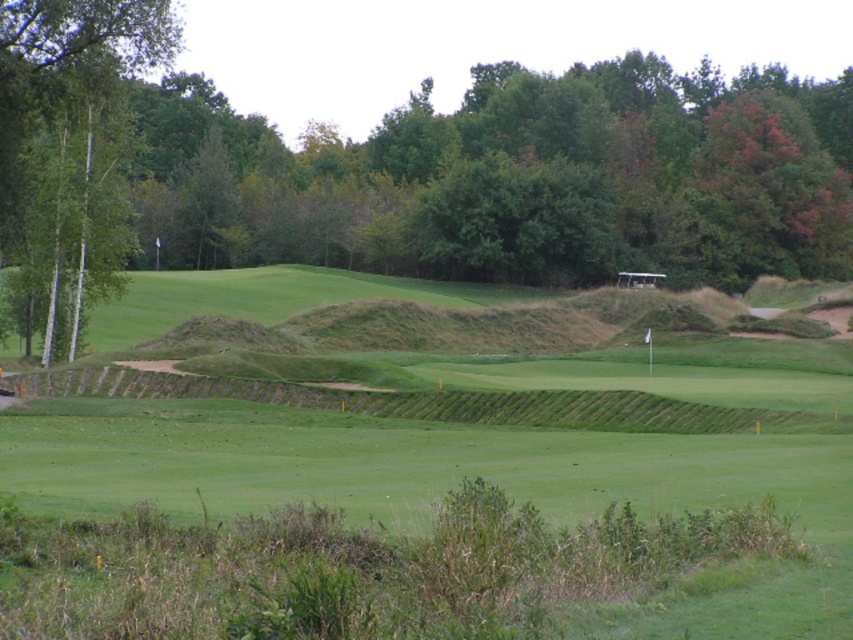
Question: Considering the real-world distances, which object is farthest from the green grassy golf course at center?

Choices:
 (A) green leafy tree at left
 (B) green leafy tree at center

Answer: (B)

Question: Which object is closer to the camera taking this photo?

Choices:
 (A) green leafy tree at left
 (B) green grassy golf course at center

Answer: (B)

Question: Is green leafy tree at center wider than green grassy golf course at center?

Choices:
 (A) no
 (B) yes

Answer: (B)

Question: Which is farther from the green grassy golf course at center?

Choices:
 (A) green leafy tree at left
 (B) green leafy tree at center

Answer: (B)

Question: Is green leafy tree at center positioned at the back of green leafy tree at left?

Choices:
 (A) yes
 (B) no

Answer: (A)

Question: In this image, where is green leafy tree at center located relative to green leafy tree at left?

Choices:
 (A) right
 (B) left

Answer: (A)